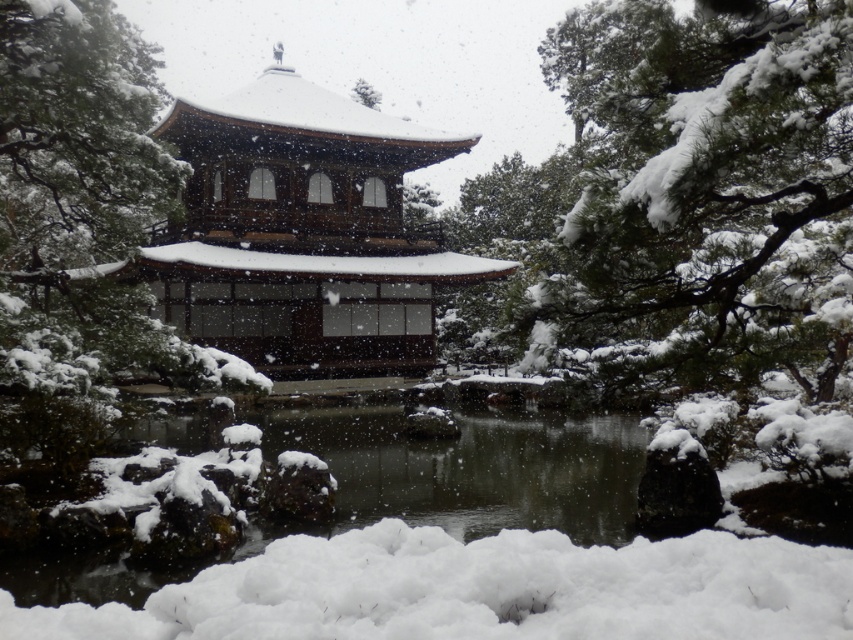
Between green textured pine tree at upper right and white smooth pond at center, which one has less height?

white smooth pond at center is shorter.

Does green textured pine tree at upper right come behind white smooth pond at center?

No.

At what (x,y) coordinates should I click in order to perform the action: click on green textured pine tree at upper right. Please return your answer as a coordinate pair (x, y). Looking at the image, I should click on (703, 196).

Find the location of `green textured pine tree at upper right`. green textured pine tree at upper right is located at coordinates (703, 196).

Who is more forward, (462, 458) or (361, 90)?

Positioned in front is point (462, 458).

Can you confirm if white smooth pond at center is positioned to the right of white fluffy snow at upper center?

Yes, white smooth pond at center is to the right of white fluffy snow at upper center.

The image size is (853, 640). I want to click on white smooth pond at center, so click(x=466, y=472).

Does point (822, 186) lie behind point (366, 90)?

No, it is not.

Does green textured pine tree at upper right have a greater height compared to white fluffy snow at upper center?

Indeed, green textured pine tree at upper right has a greater height compared to white fluffy snow at upper center.

Measure the distance between point (804, 342) and camera.

Point (804, 342) is 23.03 feet away from camera.

The image size is (853, 640). Identify the location of green textured pine tree at upper right. (703, 196).